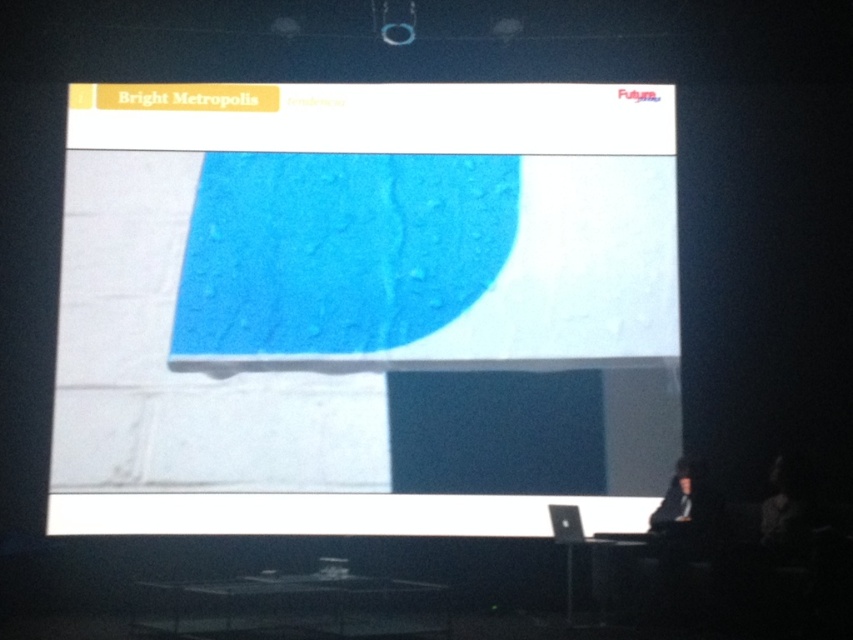
Does matte blue fabric at center appear under dark hair at lower right?

No.

Who is shorter, matte blue fabric at center or dark hair at lower right?

dark hair at lower right

Is point (177, 371) farther from viewer compared to point (775, 467)?

That is True.

Locate an element on the screen. Image resolution: width=853 pixels, height=640 pixels. matte blue fabric at center is located at coordinates (363, 305).

Is matte blue fabric at center bigger than dark fabric figure at lower right?

Yes, matte blue fabric at center is bigger than dark fabric figure at lower right.

Is point (320, 227) closer to camera compared to point (699, 532)?

No, (320, 227) is further to viewer.

This screenshot has width=853, height=640. What are the coordinates of `matte blue fabric at center` in the screenshot? It's located at (363, 305).

This screenshot has height=640, width=853. What do you see at coordinates (686, 504) in the screenshot? I see `dark fabric figure at lower right` at bounding box center [686, 504].

Does dark fabric figure at lower right have a greater height compared to dark hair at lower right?

No.

Does point (664, 506) come behind point (795, 522)?

Yes.

The width and height of the screenshot is (853, 640). In order to click on dark fabric figure at lower right in this screenshot , I will do tap(686, 504).